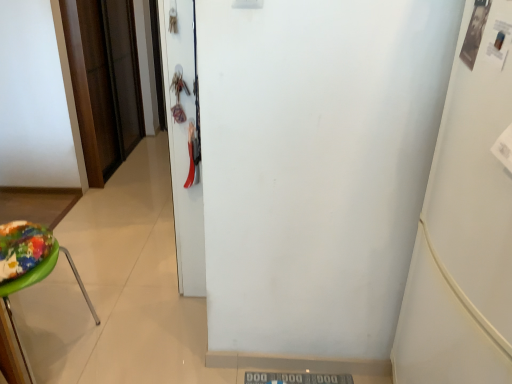
Locate an element on the screen. vacant space in front of brown wood door at left, which appears as the 1th door when viewed from the back is located at coordinates (123, 199).